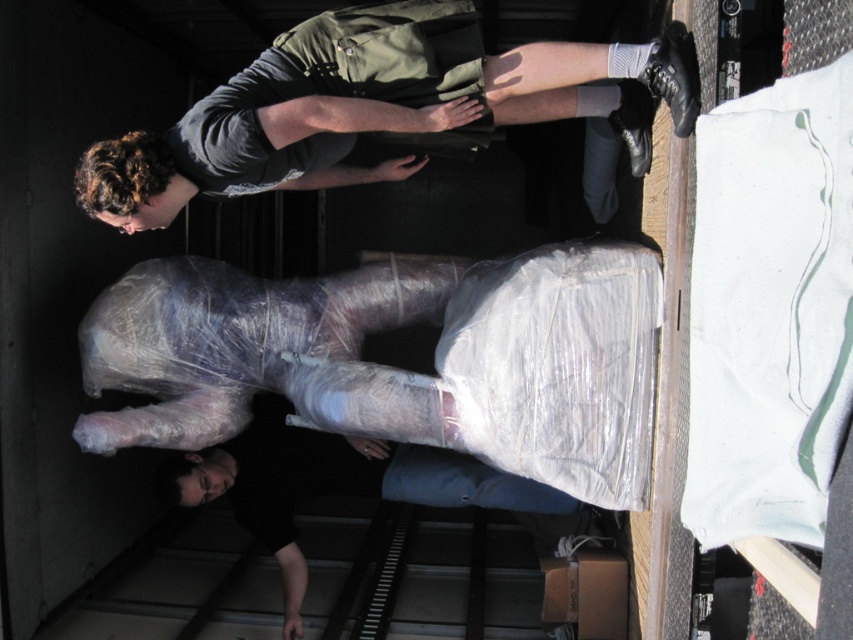
You are standing in front of the vehicle and looking at the scene. There is a point marked at coordinates (370, 108). What object is located at that point?

The point at coordinates (370, 108) corresponds to the dark gray t shirt at upper center.